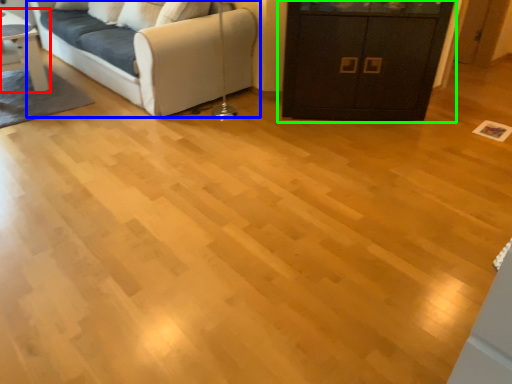
Question: Which object is positioned farthest from table (highlighted by a red box)? Select from studio couch (highlighted by a blue box) and cabinetry (highlighted by a green box).

Choices:
 (A) studio couch
 (B) cabinetry

Answer: (B)